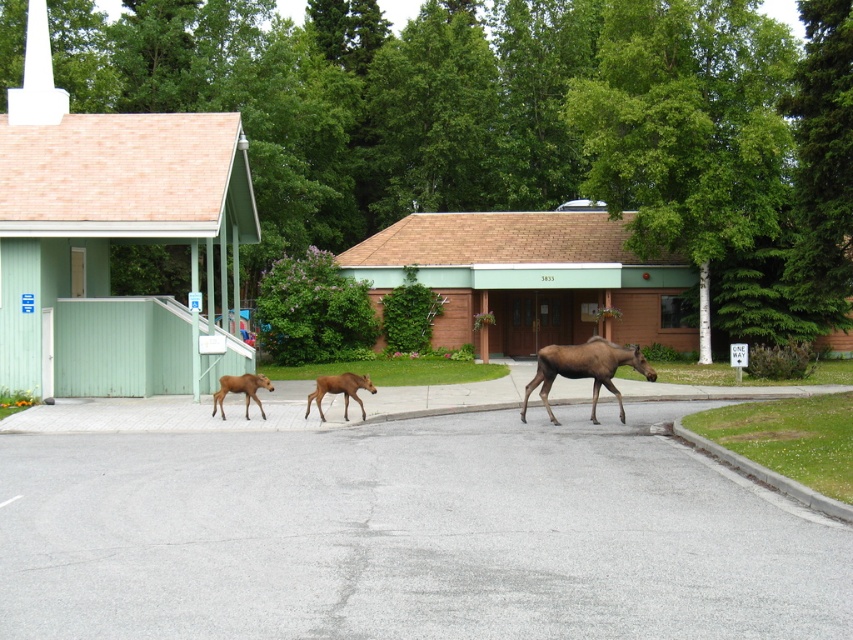
You are a wildlife photographer observing the moose family crossing the road. You notice two calves, the brown furry calf at center and the brown velvet calf at center. Which calf do you think is older based on their size?

The brown furry calf at center is older since it has a larger size compared to the brown velvet calf at center.

You are a wildlife photographer standing at the origin point of the image. You want to capture a photo of the brown matte moose at center. What are the coordinates you should aim your camera at?

The coordinates to aim your camera at are 0.578 on the x axis and 0.686 on the y axis, as the brown matte moose at center is located at point [584,369].

You are standing at the origin point of the image. There is a brown matte moose at center represented by point (x=584, y=369). What is the coordinate of the brown matte moose at center?

The brown matte moose at center is represented by point (x=584, y=369).